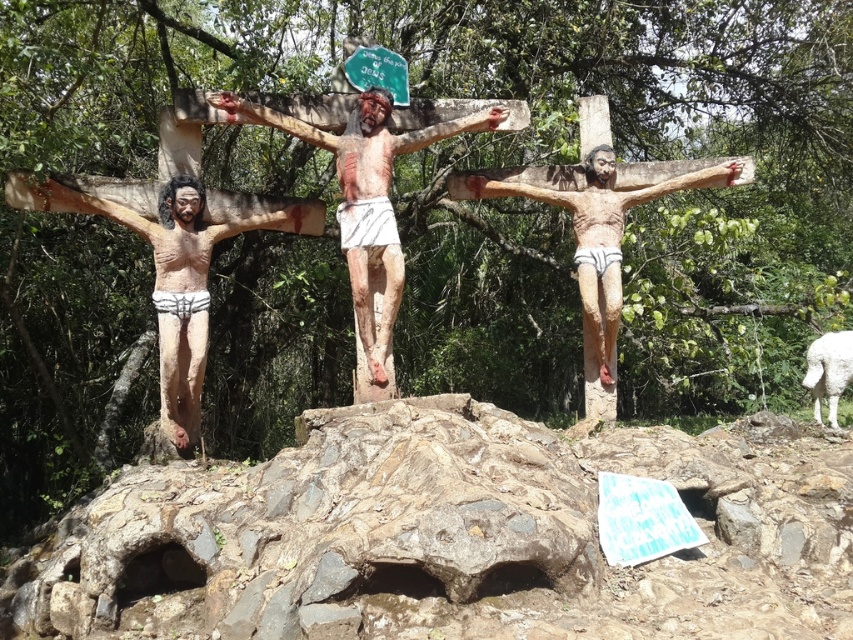
You are an archaeologist examining the outdoor site. You need to determine which object is wider between the rough stone at center and the matte wood crucifix at left. Based on the scene, which one is wider?

The rough stone at center is wider than the matte wood crucifix at left according to the description.

You are an art conservator assessing the statues in the forest scene. You need to determine which object is wider between the wooden statue at center and the wooden crucifix at center. Which one is wider?

The wooden statue at center is wider than the wooden crucifix at center according to the description.

You are a visitor at this outdoor site and want to take a photo of the wooden statue at center and the wooden crucifix at center. Which one should you focus on first if you want to capture both in the same frame without moving the camera?

The wooden statue at center is positioned under the wooden crucifix at center, so you should focus on the wooden crucifix at center first to ensure both are in the frame without moving the camera.